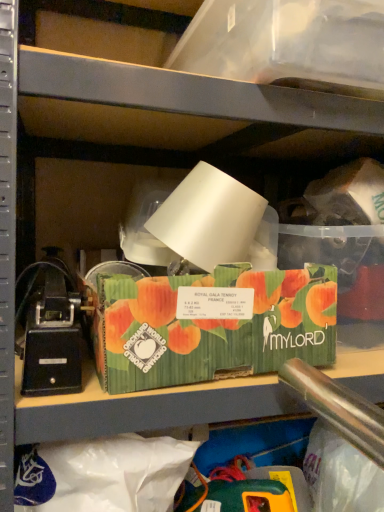
Image resolution: width=384 pixels, height=512 pixels. What do you see at coordinates (286, 42) in the screenshot?
I see `transparent plastic storage box at upper center, the 2th storage box in the bottom-to-top sequence` at bounding box center [286, 42].

Where is `green corrugated cardboard box at center, arranged as the 1th storage box when ordered from the bottom`? green corrugated cardboard box at center, arranged as the 1th storage box when ordered from the bottom is located at coordinates 213,325.

Identify the location of black plastic toy at left. The width and height of the screenshot is (384, 512). (54, 334).

From the image's perspective, is black plastic toy at left positioned above or below green corrugated cardboard box at center, arranged as the 1th storage box when ordered from the bottom?

Based on their image positions, black plastic toy at left is located beneath green corrugated cardboard box at center, arranged as the 1th storage box when ordered from the bottom.

Which of these two, black plastic toy at left or green corrugated cardboard box at center, arranged as the 1th storage box when ordered from the bottom, is smaller?

black plastic toy at left is smaller.

Is black plastic toy at left far away from green corrugated cardboard box at center, the second storage box from the top?

They are positioned close to each other.

Considering the points (48, 284) and (195, 373), which point is behind, point (48, 284) or point (195, 373)?

The point (48, 284) is farther from the camera.

Who is shorter, transparent plastic storage box at upper center, the 2th storage box in the bottom-to-top sequence, or green corrugated cardboard box at center, arranged as the 1th storage box when ordered from the bottom?

With less height is green corrugated cardboard box at center, arranged as the 1th storage box when ordered from the bottom.

From a real-world perspective, which object stands above the other?

In real-world perspective, transparent plastic storage box at upper center, the 2th storage box in the bottom-to-top sequence, is above.

In terms of size, does transparent plastic storage box at upper center, the 1th storage box in the top-to-bottom sequence, appear bigger or smaller than green corrugated cardboard box at center, arranged as the 1th storage box when ordered from the bottom?

transparent plastic storage box at upper center, the 1th storage box in the top-to-bottom sequence, is bigger than green corrugated cardboard box at center, arranged as the 1th storage box when ordered from the bottom.

Between green corrugated cardboard box at center, arranged as the 1th storage box when ordered from the bottom, and black plastic toy at left, which one has larger width?

black plastic toy at left is wider.

Can you confirm if green corrugated cardboard box at center, arranged as the 1th storage box when ordered from the bottom, is smaller than black plastic toy at left?

No, green corrugated cardboard box at center, arranged as the 1th storage box when ordered from the bottom, is not smaller than black plastic toy at left.

Which object is positioned more to the right, green corrugated cardboard box at center, arranged as the 1th storage box when ordered from the bottom, or black plastic toy at left?

green corrugated cardboard box at center, arranged as the 1th storage box when ordered from the bottom, is more to the right.

Can you confirm if black plastic toy at left is thinner than transparent plastic storage box at upper center, the 2th storage box in the bottom-to-top sequence?

Yes.

Which object is more forward, black plastic toy at left or transparent plastic storage box at upper center, the 1th storage box in the top-to-bottom sequence?

transparent plastic storage box at upper center, the 1th storage box in the top-to-bottom sequence, is in front.

Which is farther from the camera, (x=87, y=308) or (x=355, y=76)?

The point (x=87, y=308) is farther from the camera.

Would you say transparent plastic storage box at upper center, the 2th storage box in the bottom-to-top sequence, is part of black plastic toy at left's contents?

No, transparent plastic storage box at upper center, the 2th storage box in the bottom-to-top sequence, is not surrounded by black plastic toy at left.

Between transparent plastic storage box at upper center, the 2th storage box in the bottom-to-top sequence, and black plastic toy at left, which one has smaller width?

black plastic toy at left.

Between point (242, 14) and point (52, 345), which one is positioned in front?

The point (52, 345) is in front.

Does transparent plastic storage box at upper center, the 2th storage box in the bottom-to-top sequence, lie behind black plastic toy at left?

→ No, the depth of transparent plastic storage box at upper center, the 2th storage box in the bottom-to-top sequence, is less than that of black plastic toy at left.

From a real-world perspective, which object rests below the other?

black plastic toy at left.

Who is taller, green corrugated cardboard box at center, arranged as the 1th storage box when ordered from the bottom, or transparent plastic storage box at upper center, the 1th storage box in the top-to-bottom sequence?

Standing taller between the two is transparent plastic storage box at upper center, the 1th storage box in the top-to-bottom sequence.

Considering the positions of objects green corrugated cardboard box at center, arranged as the 1th storage box when ordered from the bottom, and transparent plastic storage box at upper center, the 2th storage box in the bottom-to-top sequence, in the image provided, who is behind, green corrugated cardboard box at center, arranged as the 1th storage box when ordered from the bottom, or transparent plastic storage box at upper center, the 2th storage box in the bottom-to-top sequence,?

green corrugated cardboard box at center, arranged as the 1th storage box when ordered from the bottom, is more distant.

Between green corrugated cardboard box at center, the second storage box from the top, and transparent plastic storage box at upper center, the 1th storage box in the top-to-bottom sequence, which one has larger size?

transparent plastic storage box at upper center, the 1th storage box in the top-to-bottom sequence.

Could you tell me if green corrugated cardboard box at center, arranged as the 1th storage box when ordered from the bottom, is facing transparent plastic storage box at upper center, the 2th storage box in the bottom-to-top sequence?

No, green corrugated cardboard box at center, arranged as the 1th storage box when ordered from the bottom, is not oriented towards transparent plastic storage box at upper center, the 2th storage box in the bottom-to-top sequence.

Locate an element on the screen. toy located underneath the green corrugated cardboard box at center, the second storage box from the top (from a real-world perspective) is located at coordinates (54, 334).

Locate an element on the screen. Image resolution: width=384 pixels, height=512 pixels. storage box in front of the green corrugated cardboard box at center, the second storage box from the top is located at coordinates (286, 42).

Based on the photo, based on their spatial positions, is black plastic toy at left or green corrugated cardboard box at center, arranged as the 1th storage box when ordered from the bottom, further from transparent plastic storage box at upper center, the 1th storage box in the top-to-bottom sequence?

black plastic toy at left is further to transparent plastic storage box at upper center, the 1th storage box in the top-to-bottom sequence.

Estimate the real-world distances between objects in this image. Which object is further from green corrugated cardboard box at center, the second storage box from the top, black plastic toy at left or transparent plastic storage box at upper center, the 2th storage box in the bottom-to-top sequence?

transparent plastic storage box at upper center, the 2th storage box in the bottom-to-top sequence, lies further to green corrugated cardboard box at center, the second storage box from the top, than the other object.

From the image, which object appears to be nearer to black plastic toy at left, green corrugated cardboard box at center, the second storage box from the top, or transparent plastic storage box at upper center, the 1th storage box in the top-to-bottom sequence?

green corrugated cardboard box at center, the second storage box from the top, is closer to black plastic toy at left.

When comparing their distances from green corrugated cardboard box at center, the second storage box from the top, does transparent plastic storage box at upper center, the 1th storage box in the top-to-bottom sequence, or black plastic toy at left seem closer?

The object closer to green corrugated cardboard box at center, the second storage box from the top, is black plastic toy at left.

From the image, which object appears to be nearer to black plastic toy at left, transparent plastic storage box at upper center, the 2th storage box in the bottom-to-top sequence, or green corrugated cardboard box at center, the second storage box from the top?

green corrugated cardboard box at center, the second storage box from the top.

When comparing their distances from transparent plastic storage box at upper center, the 2th storage box in the bottom-to-top sequence, does green corrugated cardboard box at center, arranged as the 1th storage box when ordered from the bottom, or black plastic toy at left seem closer?

The object closer to transparent plastic storage box at upper center, the 2th storage box in the bottom-to-top sequence, is green corrugated cardboard box at center, arranged as the 1th storage box when ordered from the bottom.

Find the location of a particular element. storage box between transparent plastic storage box at upper center, the 1th storage box in the top-to-bottom sequence, and black plastic toy at left vertically is located at coordinates (213, 325).